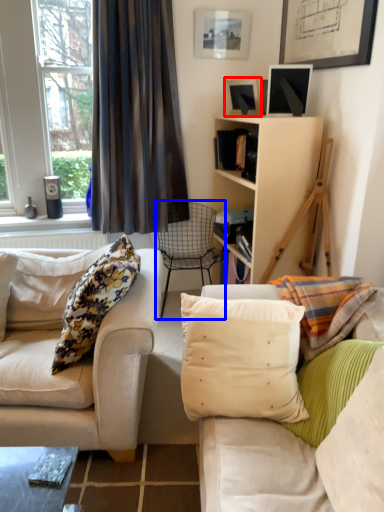
Question: Among these objects, which one is nearest to the camera, picture frame (highlighted by a red box) or chair (highlighted by a blue box)?

Choices:
 (A) picture frame
 (B) chair

Answer: (A)